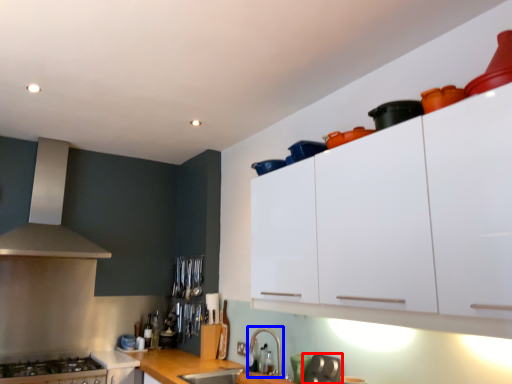
Question: Which of the following is the closest to the observer, appliance (highlighted by a red box) or faucet (highlighted by a blue box)?

Choices:
 (A) appliance
 (B) faucet

Answer: (A)